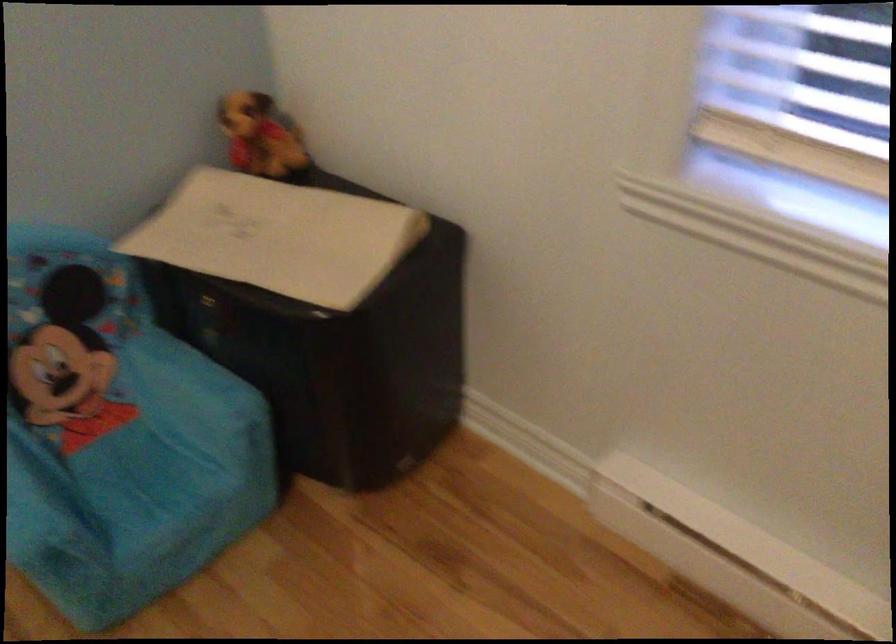
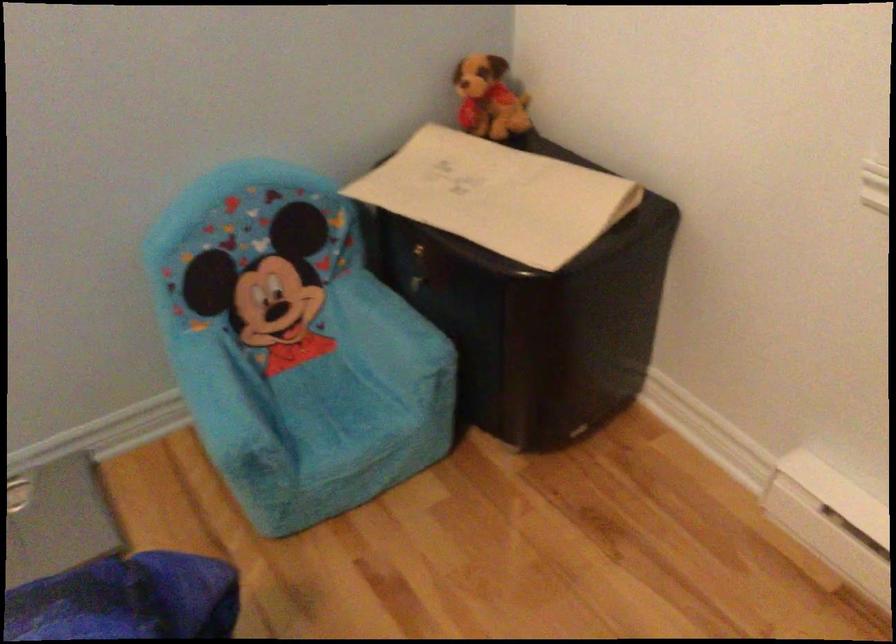
Where in the second image is the point corresponding to (286,238) from the first image?

(497, 196)